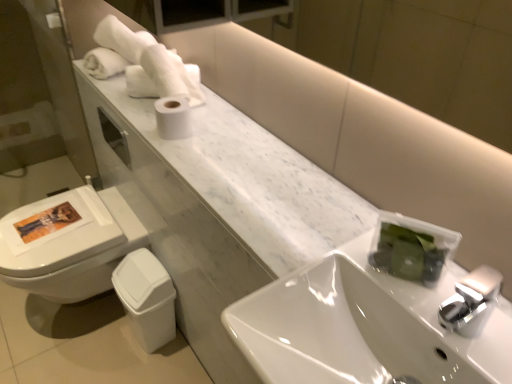
You are a GUI agent. You are given a task and a screenshot of the screen. Output one action in this format:
    pyautogui.click(x=<x>, y=<y>)
    Task: Click on the white soft towel at upper left
    
    Given the screenshot: What is the action you would take?
    coord(149,59)

In order to face white glossy sink at center, should I rotate leftwards or rightwards?

To face it directly, rotate right by 14.870 degrees.

Describe the element at coordinates (361, 328) in the screenshot. This screenshot has width=512, height=384. I see `white glossy sink at center` at that location.

This screenshot has width=512, height=384. In order to click on white marble counter at upper left in this screenshot , I will do `click(218, 207)`.

Find the location of a particular element. white soft towel at upper left is located at coordinates (149, 59).

Is there a large distance between white glossy sink at center and white soft towel at upper left?

No, there isn't a large distance between white glossy sink at center and white soft towel at upper left.

Considering the relative sizes of white glossy sink at center and white soft towel at upper left in the image provided, is white glossy sink at center thinner than white soft towel at upper left?

In fact, white glossy sink at center might be wider than white soft towel at upper left.

Between point (448, 336) and point (127, 52), which one is positioned in front?

The point (448, 336) is closer.

Is white glossy sink at center oriented away from white soft towel at upper left?

No, white glossy sink at center's orientation is not away from white soft towel at upper left.

Would you say white glossy sink at center is part of white soft towel at upper left's contents?

Actually, white glossy sink at center is outside white soft towel at upper left.

From the image's perspective, which is below, white soft towel at upper left or white glossy sink at center?

white glossy sink at center, from the image's perspective.

Does point (163, 76) lie in front of point (391, 285)?

No.

Considering the sizes of white soft towel at upper left and white glossy sink at center in the image, is white soft towel at upper left wider or thinner than white glossy sink at center?

In the image, white soft towel at upper left appears to be more narrow than white glossy sink at center.

In the scene shown: Would you say white soft towel at upper left is inside or outside white matte toilet paper at center?

white soft towel at upper left lies outside white matte toilet paper at center.

Looking at this image, is white soft towel at upper left not close to white matte toilet paper at center?

Actually, white soft towel at upper left and white matte toilet paper at center are a little close together.

Based on their positions, is white soft towel at upper left located to the left or right of white matte toilet paper at center?

From the image, it's evident that white soft towel at upper left is to the left of white matte toilet paper at center.

From the picture: Who is taller, white soft towel at upper left or white matte toilet paper at center?

white soft towel at upper left.

Image resolution: width=512 pixels, height=384 pixels. What are the coordinates of `bath towel behind the white marble counter at upper left` in the screenshot? It's located at (149, 59).

How different are the orientations of white soft towel at upper left and white marble counter at upper left in degrees?

39 degrees.

Who is smaller, white soft towel at upper left or white marble counter at upper left?

white soft towel at upper left.

Which of these two, white marble counter at upper left or white soft towel at upper left, stands shorter?

Standing shorter between the two is white marble counter at upper left.

Is point (266, 189) less distant than point (131, 48)?

Yes.

Is the depth of white marble counter at upper left greater than that of white soft towel at upper left?

No, white marble counter at upper left is closer to the viewer.

This screenshot has width=512, height=384. In order to click on bath towel above the white marble counter at upper left (from a real-world perspective) in this screenshot , I will do `click(149, 59)`.

This screenshot has width=512, height=384. Find the location of `toilet paper on the left side of white glossy sink at center`. toilet paper on the left side of white glossy sink at center is located at coordinates (173, 118).

Looking at this image, from a real-world perspective, is white matte toilet paper at center above or below white glossy sink at center?

In terms of real-world spatial position, white matte toilet paper at center is above white glossy sink at center.

Are white matte toilet paper at center and white glossy sink at center beside each other?

No, white matte toilet paper at center is not next to white glossy sink at center.

Which of these two, white matte toilet paper at center or white glossy sink at center, is wider?

Wider between the two is white glossy sink at center.

Who is bigger, white marble counter at upper left or white matte toilet paper at center?

white marble counter at upper left is bigger.

Is white marble counter at upper left not within white matte toilet paper at center?

That's correct, white marble counter at upper left is outside of white matte toilet paper at center.

Can you tell me how much white marble counter at upper left and white matte toilet paper at center differ in facing direction?

0.245 degrees.

Which is in front, white marble counter at upper left or white matte toilet paper at center?

white marble counter at upper left.

This screenshot has height=384, width=512. Identify the location of bath towel behind the white glossy sink at center. (149, 59).

Locate an element on the screen. The height and width of the screenshot is (384, 512). bath towel that appears on the left of white glossy sink at center is located at coordinates (149, 59).

Looking at the image, which one is located further to white glossy sink at center, white matte toilet paper at center or white marble counter at upper left?

white matte toilet paper at center is positioned further to the anchor white glossy sink at center.

Which object lies further to the anchor point white soft towel at upper left, white glossy sink at center or white marble counter at upper left?

Based on the image, white glossy sink at center appears to be further to white soft towel at upper left.

Estimate the real-world distances between objects in this image. Which object is further from white marble counter at upper left, white matte toilet paper at center or white soft towel at upper left?

Based on the image, white soft towel at upper left appears to be further to white marble counter at upper left.

When comparing their distances from white glossy sink at center, does white soft towel at upper left or white marble counter at upper left seem further?

Among the two, white soft towel at upper left is located further to white glossy sink at center.

From the image, which object appears to be nearer to white soft towel at upper left, white matte toilet paper at center or white glossy sink at center?

white matte toilet paper at center lies closer to white soft towel at upper left than the other object.

Considering their positions, is white marble counter at upper left positioned closer to white soft towel at upper left than white matte toilet paper at center?

white matte toilet paper at center is closer to white soft towel at upper left.

Estimate the real-world distances between objects in this image. Which object is closer to white marble counter at upper left, white matte toilet paper at center or white glossy sink at center?

The object closer to white marble counter at upper left is white glossy sink at center.

Based on their spatial positions, is white glossy sink at center or white soft towel at upper left closer to white marble counter at upper left?

white glossy sink at center is closer to white marble counter at upper left.

Locate an element on the screen. Image resolution: width=512 pixels, height=384 pixels. counter located between white glossy sink at center and white soft towel at upper left in the depth direction is located at coordinates (218, 207).

Find the location of a particular element. The image size is (512, 384). toilet paper positioned between white marble counter at upper left and white soft towel at upper left from near to far is located at coordinates (173, 118).

Find the location of `toilet paper between white glossy sink at center and white soft towel at upper left along the z-axis`. toilet paper between white glossy sink at center and white soft towel at upper left along the z-axis is located at coordinates (173, 118).

Image resolution: width=512 pixels, height=384 pixels. I want to click on counter positioned between white glossy sink at center and white matte toilet paper at center from near to far, so click(218, 207).